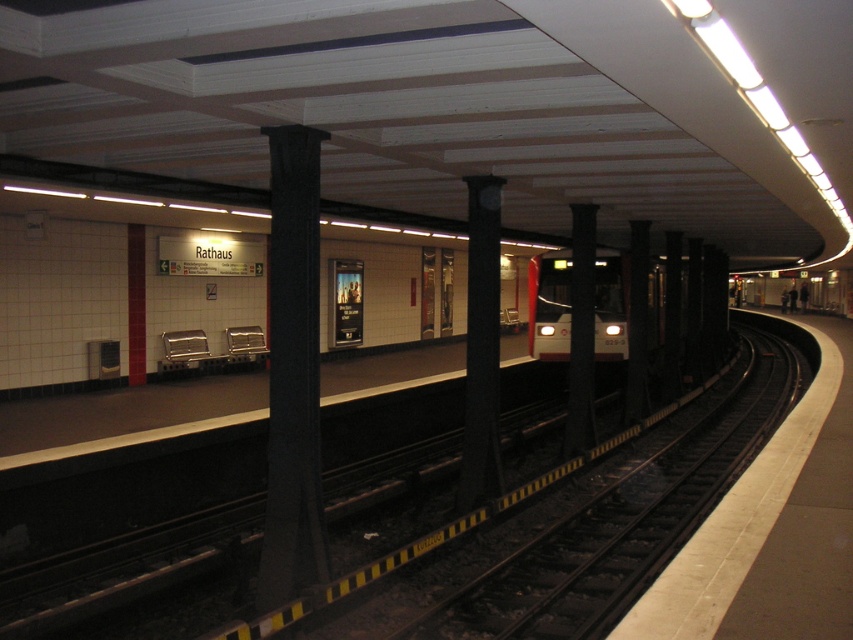
Does black metal track at center appear on the right side of black polished pillar at center?

Correct, you'll find black metal track at center to the right of black polished pillar at center.

Is point (717, 456) less distant than point (461, 458)?

No.

Does point (210, 611) come farther from viewer compared to point (474, 449)?

No, (210, 611) is in front of (474, 449).

Image resolution: width=853 pixels, height=640 pixels. I want to click on black metal track at center, so click(589, 520).

Locate an element on the screen. black metal track at center is located at coordinates (589, 520).

In the scene shown: Can you confirm if black metal track at center is taller than white glossy train at center?

No, black metal track at center is not taller than white glossy train at center.

Does point (457, 608) come in front of point (604, 349)?

That is True.

This screenshot has width=853, height=640. What are the coordinates of `black metal track at center` in the screenshot? It's located at (589, 520).

Between black metal track at center and black concrete pillar at center, which one has more height?

black concrete pillar at center is taller.

Does black metal track at center appear on the right side of black concrete pillar at center?

Indeed, black metal track at center is positioned on the right side of black concrete pillar at center.

Where is `black metal track at center`? The image size is (853, 640). black metal track at center is located at coordinates (589, 520).